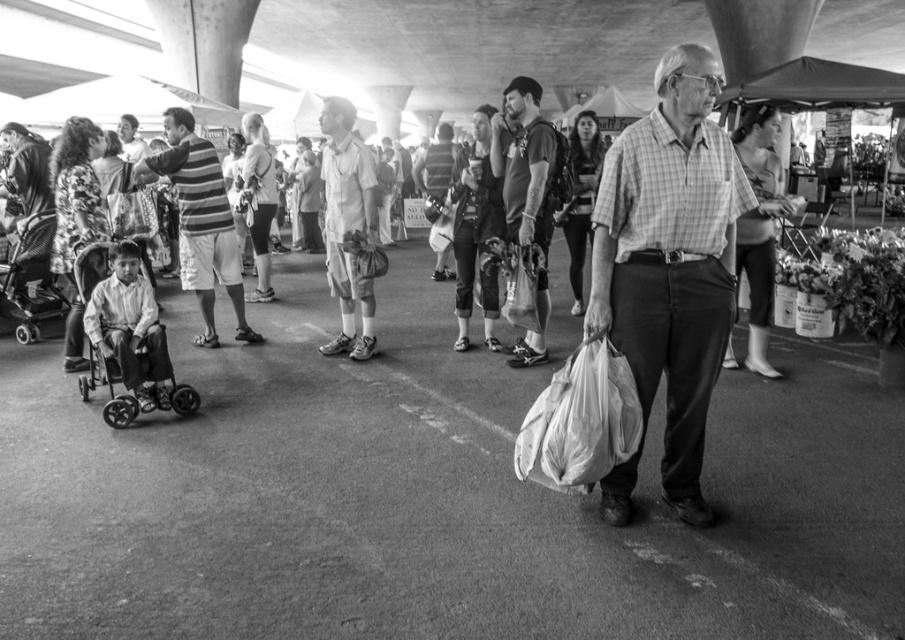
You are a photographer trying to capture a clear shot of both the matte white plastic bag at center and the light brown leather shoes at center in this market scene. Since you want to emphasize the size difference between them, which object should you zoom in on more to highlight its larger size?

The matte white plastic bag at center is bigger than the light brown leather shoes at center, so you should zoom in more on the matte white plastic bag at center to emphasize its larger size.